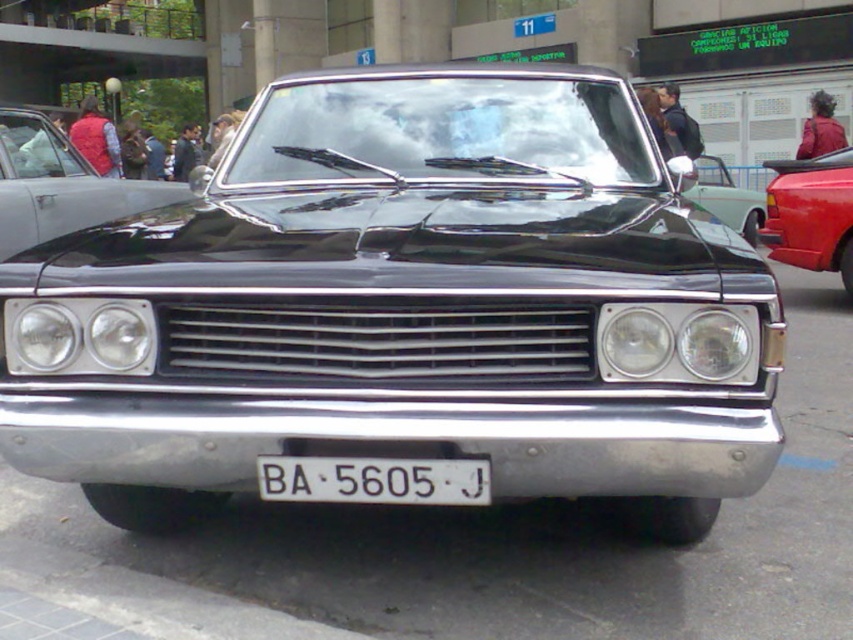
Consider the image. You are a photographer trying to capture the glossy black car at left and the white plastic license plate at center in a single shot. Based on their positions, which object should you focus on first if you want to ensure both are in clear focus?

The glossy black car at left is above the white plastic license plate at center, so focusing on the car first will help ensure both are in clear focus since it is closer to the camera.

You are a photographer trying to capture the white plastic license plate at center clearly. You notice the glossy black car at left is blocking your view. Based on their positions, can you adjust your angle to see the license plate without moving the car?

The glossy black car at left is further to the viewer than the white plastic license plate at center, so by moving your position slightly to the side or adjusting your angle, you can see the license plate behind the car.

You are a delivery person who needs to attach a sticker to the license plate. The sticker must be placed on the largest object between the white plastic license plate at center and the shiny chrome mirror at center. Which object should you choose?

The shiny chrome mirror at center is larger than the white plastic license plate at center, so you should place the sticker on the shiny chrome mirror at center.